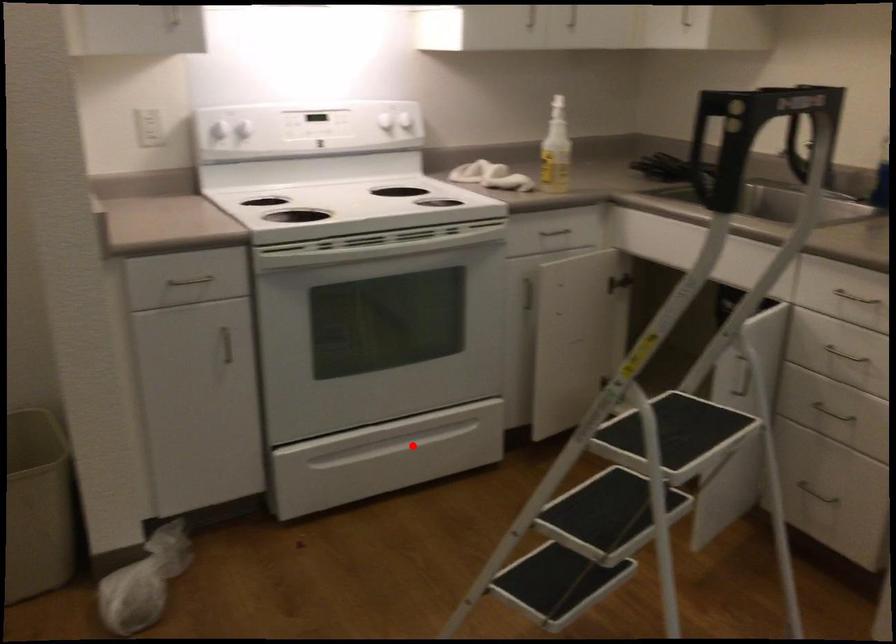
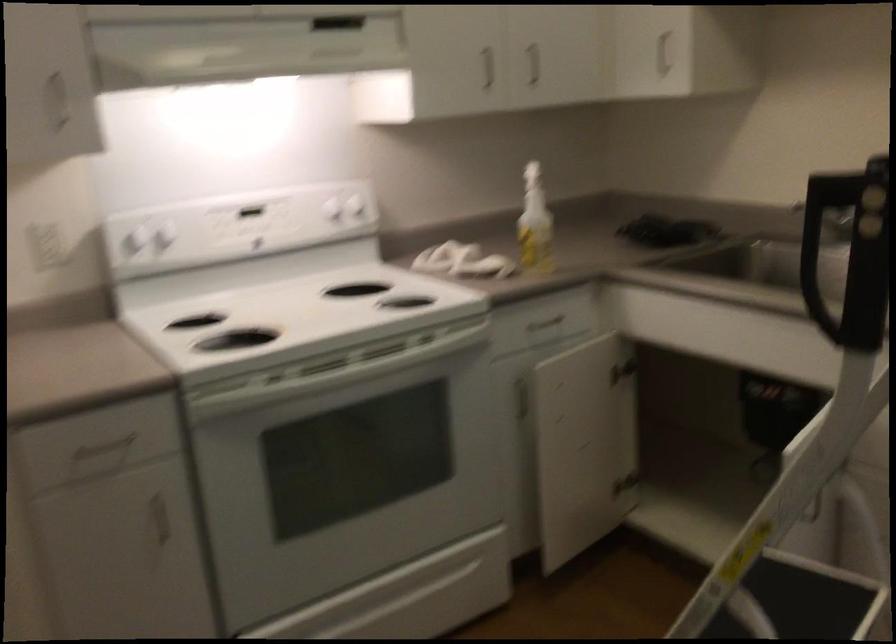
Question: A red point is marked in image1. In image2, is the corresponding 3D point closer to the camera or farther? Reply with the corresponding letter.

Choices:
 (A) The corresponding 3D point is closer.
 (B) The corresponding 3D point is farther.

Answer: (A)